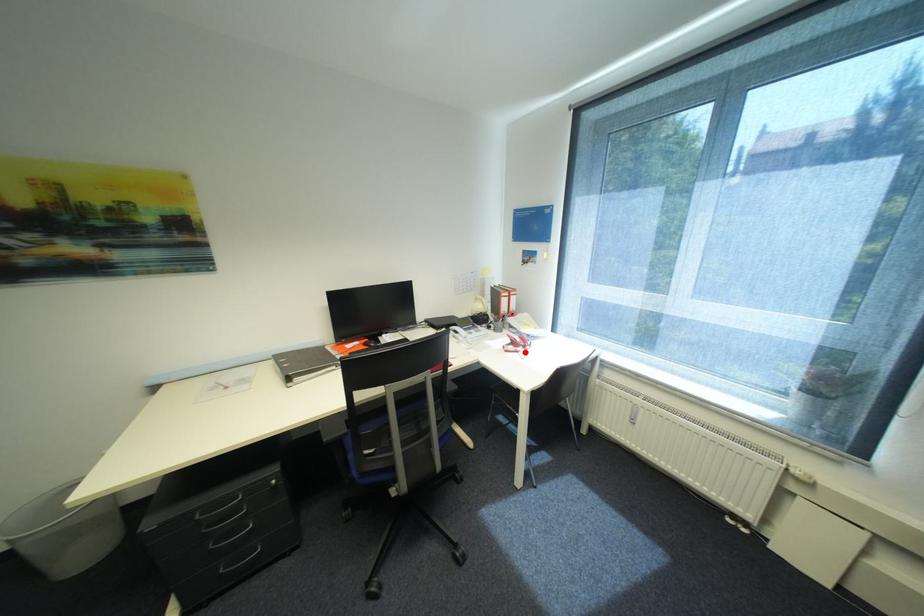
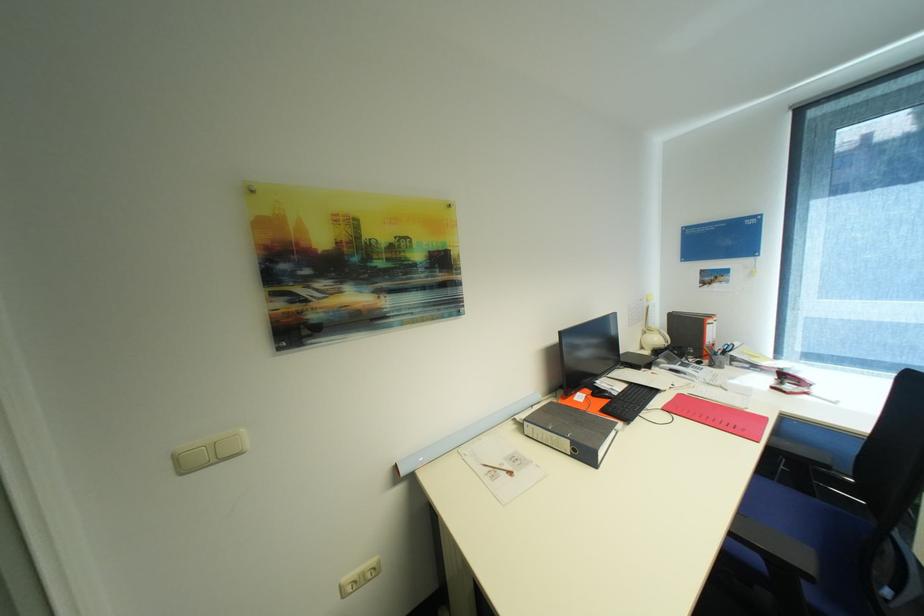
Where in the second image is the point corresponding to the highlighted location from the first image?

(813, 394)